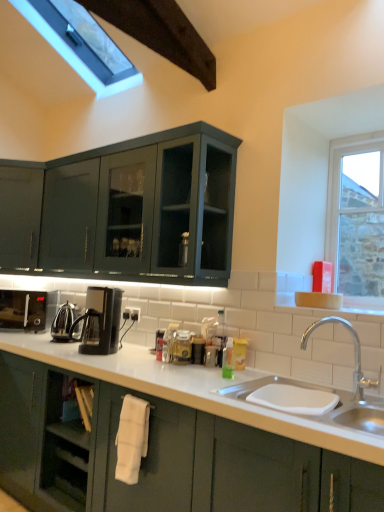
Question: Can you confirm if black plastic coffee machine at lower left, which ranks as the 2th coffee machine in front-to-back order, is wider than white glossy sink at lower right?

Choices:
 (A) no
 (B) yes

Answer: (A)

Question: Considering the relative sizes of black plastic coffee machine at lower left, which ranks as the 2th coffee machine in front-to-back order, and white glossy sink at lower right in the image provided, is black plastic coffee machine at lower left, which ranks as the 2th coffee machine in front-to-back order, shorter than white glossy sink at lower right?

Choices:
 (A) yes
 (B) no

Answer: (A)

Question: From the image's perspective, is black plastic coffee machine at lower left, acting as the first coffee machine starting from the left, located beneath white glossy sink at lower right?

Choices:
 (A) no
 (B) yes

Answer: (A)

Question: Is black plastic coffee machine at lower left, which ranks as the 2th coffee machine in front-to-back order, touching white glossy sink at lower right?

Choices:
 (A) yes
 (B) no

Answer: (B)

Question: From a real-world perspective, does black plastic coffee machine at lower left, the second coffee machine when ordered from right to left, sit lower than white glossy sink at lower right?

Choices:
 (A) yes
 (B) no

Answer: (B)

Question: Considering the relative positions of clear glass window at upper right and white glossy sink at lower right in the image provided, is clear glass window at upper right to the left or to the right of white glossy sink at lower right?

Choices:
 (A) right
 (B) left

Answer: (A)

Question: From a real-world perspective, is clear glass window at upper right above or below white glossy sink at lower right?

Choices:
 (A) above
 (B) below

Answer: (A)

Question: Relative to white glossy sink at lower right, is clear glass window at upper right in front or behind?

Choices:
 (A) front
 (B) behind

Answer: (B)

Question: Is point (352, 173) positioned closer to the camera than point (276, 468)?

Choices:
 (A) closer
 (B) farther

Answer: (B)

Question: From a real-world perspective, relative to polished stainless steel kettle at center-left, marked as the second appliance in a front-to-back arrangement, is white fabric towel at lower center vertically above or below?

Choices:
 (A) above
 (B) below

Answer: (B)

Question: From the image's perspective, is white fabric towel at lower center positioned above or below polished stainless steel kettle at center-left, which is the 1th appliance from back to front?

Choices:
 (A) above
 (B) below

Answer: (B)

Question: Is point (112, 391) closer or farther from the camera than point (66, 333)?

Choices:
 (A) closer
 (B) farther

Answer: (A)

Question: Based on their positions, is white fabric towel at lower center located to the left or right of polished stainless steel kettle at center-left, which is the 1th appliance from back to front?

Choices:
 (A) left
 (B) right

Answer: (B)

Question: In terms of width, does clear glass window at upper right look wider or thinner when compared to white fabric towel at lower center?

Choices:
 (A) thin
 (B) wide

Answer: (B)

Question: Visually, is clear glass window at upper right positioned to the left or to the right of white fabric towel at lower center?

Choices:
 (A) right
 (B) left

Answer: (A)